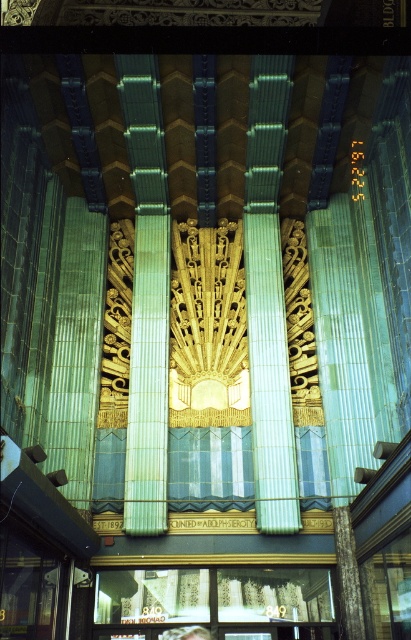
Question: Which point is farther to the camera?

Choices:
 (A) (94, 612)
 (B) (168, 636)

Answer: (A)

Question: Which of the following is the closest to the observer?

Choices:
 (A) (193, 636)
 (B) (309, 593)

Answer: (A)

Question: Does white textured curtains at lower center lie behind light brown hair at lower center?

Choices:
 (A) no
 (B) yes

Answer: (B)

Question: Does white textured curtains at lower center appear under light brown hair at lower center?

Choices:
 (A) no
 (B) yes

Answer: (A)

Question: Can you confirm if white textured curtains at lower center is thinner than light brown hair at lower center?

Choices:
 (A) yes
 (B) no

Answer: (B)